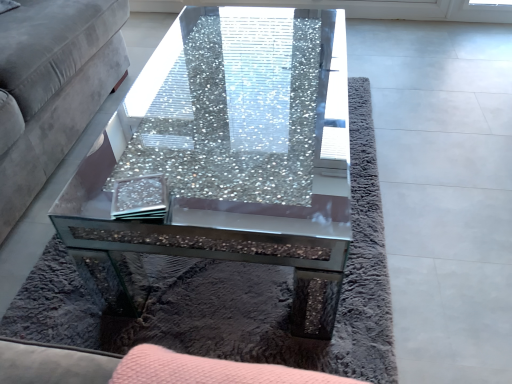
Image resolution: width=512 pixels, height=384 pixels. I want to click on crushed glass coffee table at center, so click(x=234, y=151).

What do you see at coordinates (234, 151) in the screenshot? The image size is (512, 384). I see `crushed glass coffee table at center` at bounding box center [234, 151].

What is the approximate width of clear glass coaster at center?

clear glass coaster at center is 4.81 inches in width.

Locate an element on the screen. Image resolution: width=512 pixels, height=384 pixels. velvet grey couch at left is located at coordinates (52, 87).

Is clear glass coaster at center at the left side of velvet grey couch at left?

No.

Which of these two, clear glass coaster at center or velvet grey couch at left, is smaller?

Smaller between the two is clear glass coaster at center.

In terms of width, does clear glass coaster at center look wider or thinner when compared to velvet grey couch at left?

clear glass coaster at center is thinner than velvet grey couch at left.

Can you tell me how much clear glass coaster at center and velvet grey couch at left differ in facing direction?

They differ by 14.4 degrees in their facing directions.

Considering the sizes of objects velvet grey couch at left and crushed glass coffee table at center in the image provided, who is bigger, velvet grey couch at left or crushed glass coffee table at center?

velvet grey couch at left is bigger.

Between point (16, 92) and point (134, 135), which one is positioned in front?

The point (134, 135) is closer to the camera.

In terms of width, does velvet grey couch at left look wider or thinner when compared to crushed glass coffee table at center?

velvet grey couch at left is wider than crushed glass coffee table at center.

From the image's perspective, is velvet grey couch at left on top of crushed glass coffee table at center?

Yes, from the image's perspective, velvet grey couch at left is on top of crushed glass coffee table at center.

Is crushed glass coffee table at center directly adjacent to clear glass coaster at center?

There is a gap between crushed glass coffee table at center and clear glass coaster at center.

From a real-world perspective, is crushed glass coffee table at center positioned under clear glass coaster at center based on gravity?

Yes, from a real-world perspective, crushed glass coffee table at center is below clear glass coaster at center.

Is crushed glass coffee table at center located outside clear glass coaster at center?

crushed glass coffee table at center is positioned outside clear glass coaster at center.

From the image's perspective, between crushed glass coffee table at center and clear glass coaster at center, which one is located above?

From the image's view, crushed glass coffee table at center is above.

Which of these two, crushed glass coffee table at center or velvet grey couch at left, is wider?

velvet grey couch at left is wider.

Locate an element on the screen. This screenshot has height=384, width=512. studio couch on the left of crushed glass coffee table at center is located at coordinates click(52, 87).

Is point (304, 312) positioned behind point (79, 6)?

That is False.

Does point (143, 200) come closer to viewer compared to point (219, 249)?

Yes, point (143, 200) is closer to viewer.

From a real-world perspective, between clear glass coaster at center and crushed glass coffee table at center, who is vertically lower?

crushed glass coffee table at center, from a real-world perspective.

Does clear glass coaster at center have a greater width compared to crushed glass coffee table at center?

No.

Are clear glass coaster at center and crushed glass coffee table at center beside each other?

No, clear glass coaster at center is not beside crushed glass coffee table at center.

The height and width of the screenshot is (384, 512). Identify the location of pad on the right side of velvet grey couch at left. (x=140, y=198).

Considering the sizes of objects velvet grey couch at left and clear glass coaster at center in the image provided, who is thinner, velvet grey couch at left or clear glass coaster at center?

Thinner between the two is clear glass coaster at center.

Does point (23, 82) come closer to viewer compared to point (140, 218)?

No, (23, 82) is further to viewer.

Does velvet grey couch at left lie behind clear glass coaster at center?

No, the depth of velvet grey couch at left is less than that of clear glass coaster at center.

The width and height of the screenshot is (512, 384). Identify the location of pad above the velvet grey couch at left (from a real-world perspective). (140, 198).

Where is `coffee table behind the velvet grey couch at left`? The image size is (512, 384). coffee table behind the velvet grey couch at left is located at coordinates (234, 151).

When comparing their distances from velvet grey couch at left, does crushed glass coffee table at center or clear glass coaster at center seem closer?

crushed glass coffee table at center is closer to velvet grey couch at left.

Considering their positions, is clear glass coaster at center positioned further to velvet grey couch at left than crushed glass coffee table at center?

clear glass coaster at center.

Considering their positions, is velvet grey couch at left positioned closer to crushed glass coffee table at center than clear glass coaster at center?

clear glass coaster at center is positioned closer to the anchor crushed glass coffee table at center.

Which object lies nearer to the anchor point crushed glass coffee table at center, clear glass coaster at center or velvet grey couch at left?

clear glass coaster at center lies closer to crushed glass coffee table at center than the other object.

From the image, which object appears to be farther from clear glass coaster at center, velvet grey couch at left or crushed glass coffee table at center?

The object further to clear glass coaster at center is velvet grey couch at left.

Which object lies nearer to the anchor point clear glass coaster at center, crushed glass coffee table at center or velvet grey couch at left?

crushed glass coffee table at center lies closer to clear glass coaster at center than the other object.

Find the location of a particular element. This screenshot has width=512, height=384. pad between velvet grey couch at left and crushed glass coffee table at center in the horizontal direction is located at coordinates (140, 198).